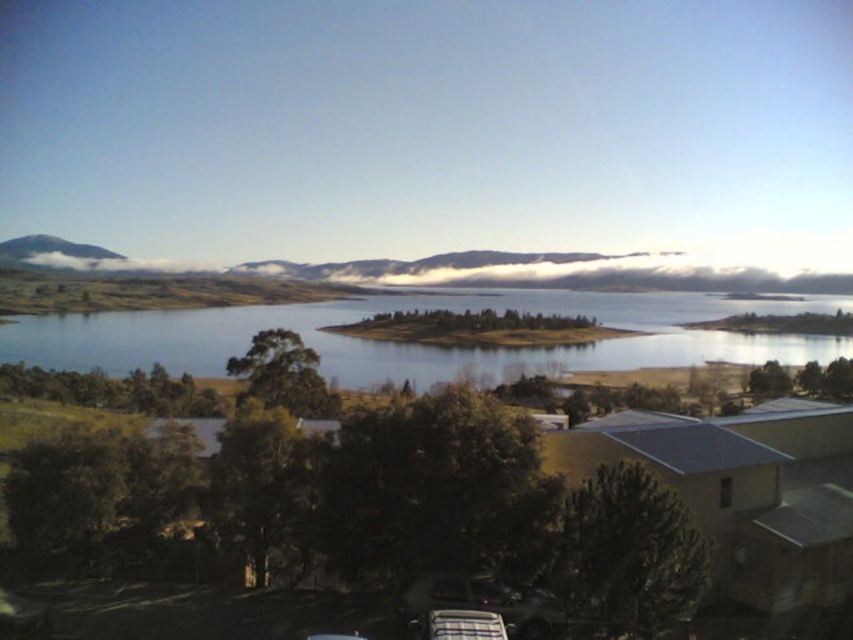
You are standing at the edge of the lake and see the metallic silver car at lower center and the smooth gray mountain at upper left. Which object would appear larger in your field of view?

The metallic silver car at lower center appears larger in your field of view because it is closer to the viewer than the smooth gray mountain at upper left.

You are a photographer trying to capture the metallic silver car at lower center without any obstructions. Based on the scene, will the white fluffy clouds at center block your view of the car?

The metallic silver car at lower center is behind the white fluffy clouds at center, so the clouds will block the view of the car.

You are standing in the serene landscape scene. There is a point marked at coordinates [555,273]. What object in the scene is located at that point?

The white fluffy clouds at center are located at the point marked by coordinates [555,273].